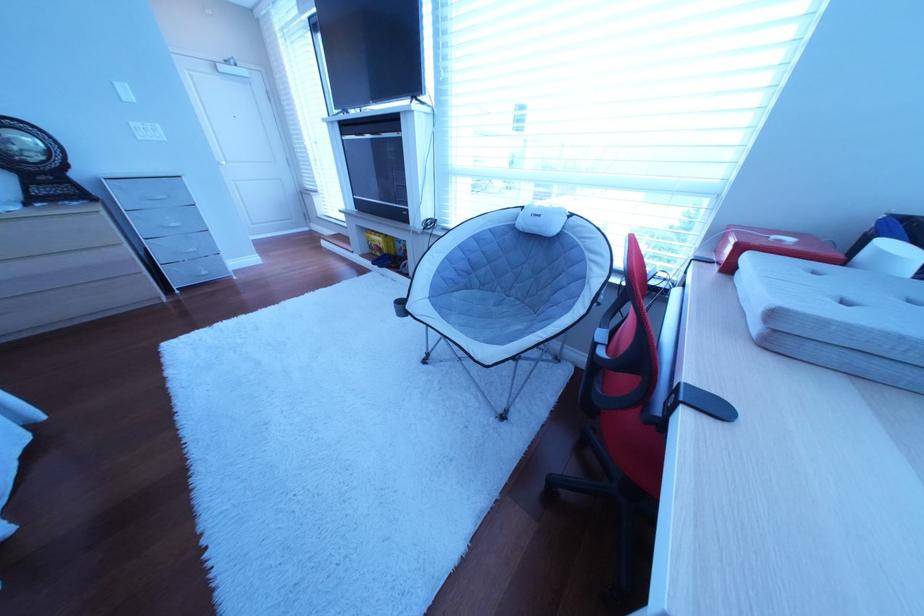
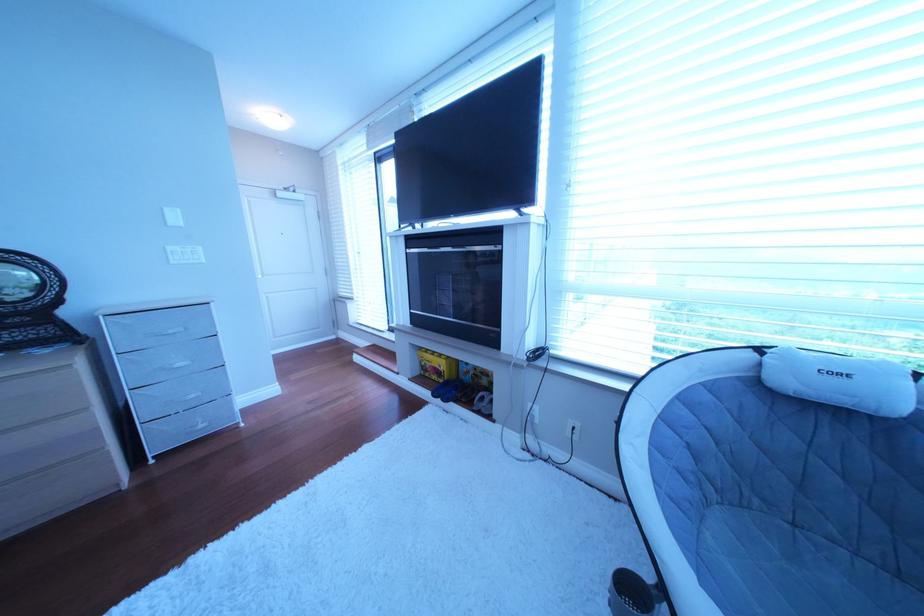
Where in the second image is the point corresponding to point 394,256 from the first image?

(450, 379)